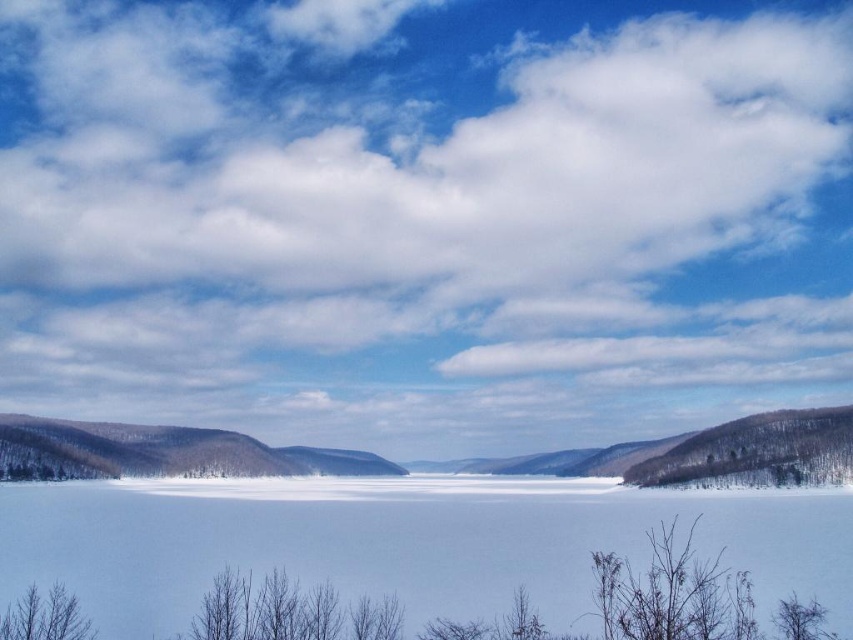
You are an artist wanting to paint the scene. You have two brushes of different sizes. The smaller brush is suitable for details that are narrower, while the larger brush is for broader areas. Which brush should you use for the bare branches at lower right and the snowy brown hillside at right?

The bare branches at lower right has a lesser width compared to snowy brown hillside at right, so you should use the smaller brush for the bare branches at lower right and the larger brush for the snowy brown hillside at right.

You are standing at the edge of the lake and notice the white ice at center. If you want to reach the ice, which direction should you walk from your current position?

The white ice at center is located at point [403,541], so you should walk towards the center of the lake to reach it.

You are an artist sketching the landscape and want to ensure proper proportions. Which object, the bare branches at lower right or the snowy brown hillside at right, should you draw larger in your sketch?

The snowy brown hillside at right should be drawn larger than the bare branches at lower right because the snowy brown hillside at right is larger in size compared to the bare branches at lower right.